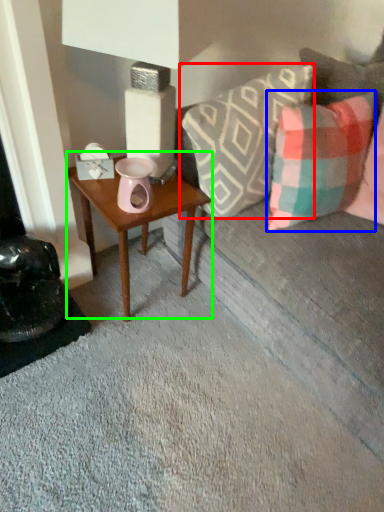
Question: Which object is positioned closest to pillow (highlighted by a red box)? Select from pillow (highlighted by a blue box) and table (highlighted by a green box).

Choices:
 (A) pillow
 (B) table

Answer: (A)